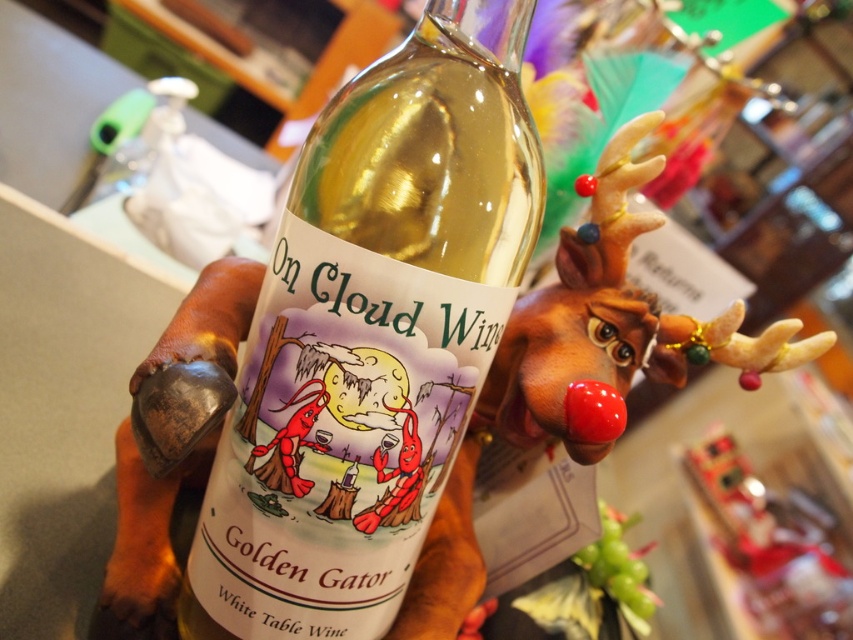
Question: Can you confirm if translucent glass bottle at center is positioned to the left of brown rubber reindeer at center?

Choices:
 (A) yes
 (B) no

Answer: (A)

Question: Which point appears closest to the camera in this image?

Choices:
 (A) (605, 332)
 (B) (315, 168)

Answer: (B)

Question: Which point is farther to the camera?

Choices:
 (A) (277, 308)
 (B) (534, 301)

Answer: (B)

Question: Which of the following is the farthest from the observer?

Choices:
 (A) (318, 122)
 (B) (527, 417)

Answer: (B)

Question: Does translucent glass bottle at center have a smaller size compared to brown rubber reindeer at center?

Choices:
 (A) no
 (B) yes

Answer: (B)

Question: Does translucent glass bottle at center have a larger size compared to brown rubber reindeer at center?

Choices:
 (A) yes
 (B) no

Answer: (B)